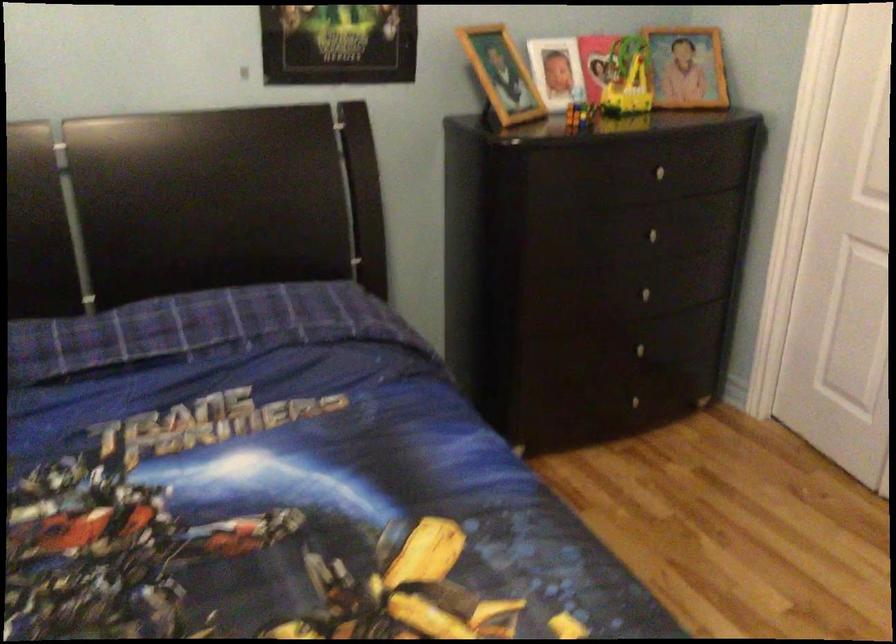
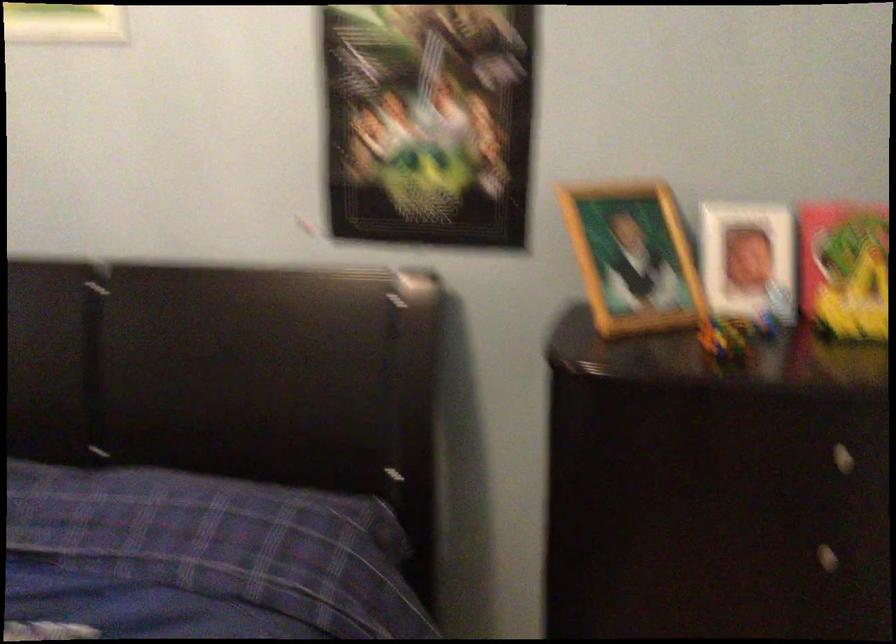
Find the pixel in the second image that matches (558,73) in the first image.

(748, 261)